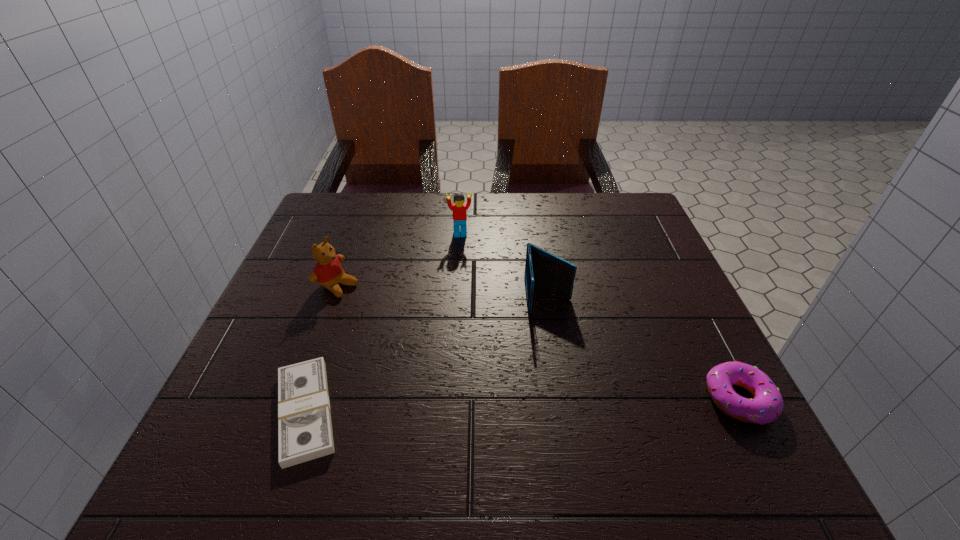
Where is `empty space that is in between the wallet and the third object from right to left`? The image size is (960, 540). empty space that is in between the wallet and the third object from right to left is located at coordinates (504, 265).

Find the location of `object identified as the third closest to the third object from left to right`. object identified as the third closest to the third object from left to right is located at coordinates (305, 433).

Locate which object is the fourth closest to the teddy bear. Please provide its 2D coordinates. Your answer should be formatted as a tuple, i.e. [(x, y)], where the tuple contains the x and y coordinates of a point satisfying the conditions above.

[(766, 406)]

Where is `free location that satisfies the following two spatial constraints: 1. on the front side of the Lego; 2. on the right side of the wallet`? free location that satisfies the following two spatial constraints: 1. on the front side of the Lego; 2. on the right side of the wallet is located at coordinates (457, 296).

At what (x,y) coordinates should I click in order to perform the action: click on free spot that satisfies the following two spatial constraints: 1. on the back side of the wallet; 2. on the right side of the dollar. Please return your answer as a coordinate pair (x, y). This screenshot has height=540, width=960. Looking at the image, I should click on (345, 296).